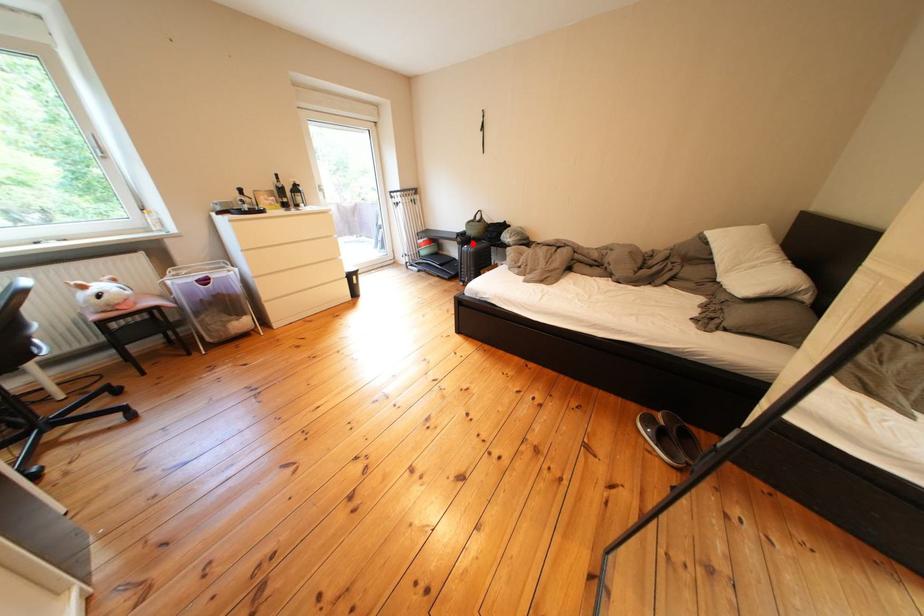
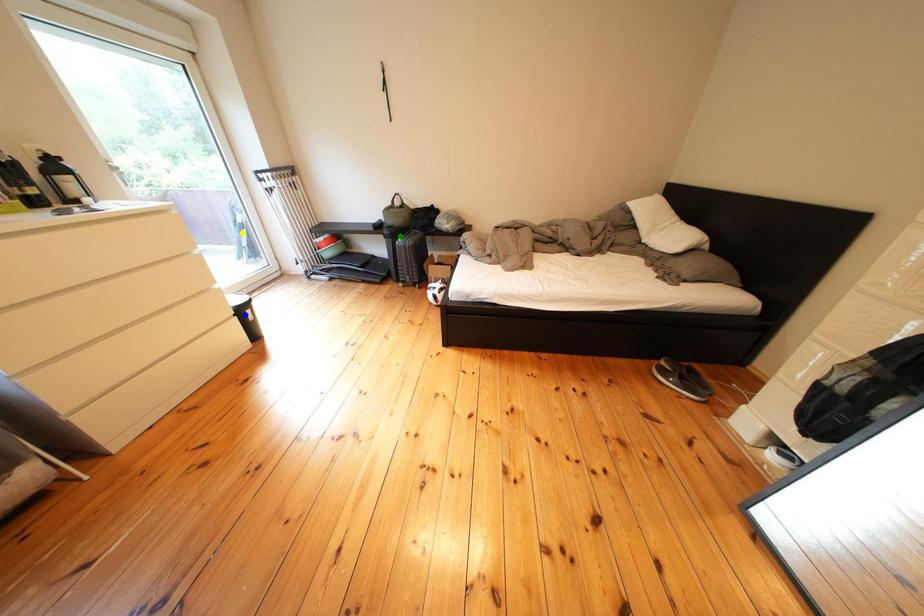
Question: I am providing you with two images of the same scene from different viewpoints. A red point is marked on the first image. You are given multiple points on the second image. Which spot in image 2 lines up with the point in image 1?

Choices:
 (A) blue point
 (B) green point
 (C) yellow point

Answer: (B)